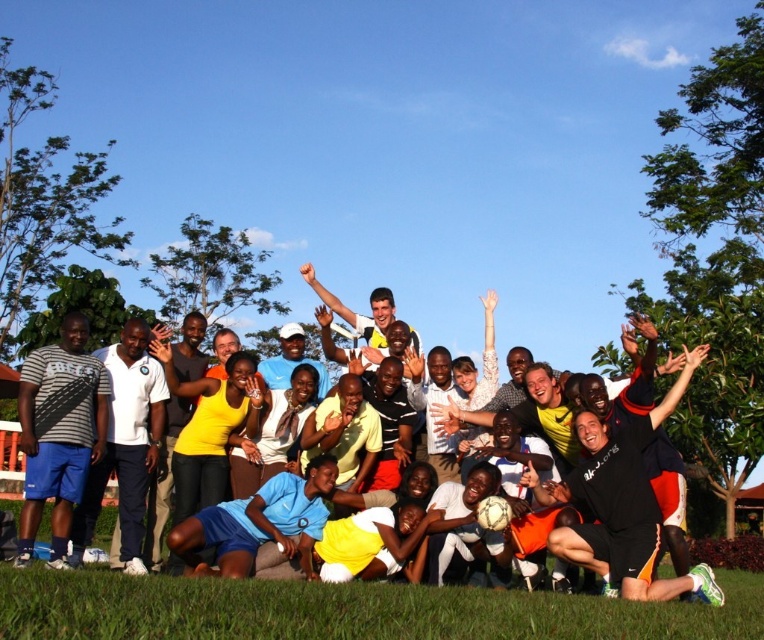
You are a photographer trying to capture a photo of the group. You notice the green grass at lower center and the matte black shirt at left. Which object is closer to the camera based on their positions?

The green grass at lower center is positioned under the matte black shirt at left, meaning the matte black shirt at left is closer to the camera since it is above the grass.

You are a photographer standing at the edge of the grassy area where the matte gray shorts at left and yellow jersey at center are located. You need to capture a photo that includes both subjects without moving them. Given that your camera has a maximum focus range of 30 feet, will you be able to capture both subjects in focus?

The distance between the matte gray shorts at left and yellow jersey at center is 31.52 feet, which exceeds the camera maximum focus range of 30 feet. Therefore, you cannot capture both subjects in focus.

You are a photographer trying to capture a photo of the group. You notice the green grass at lower center and the matte black shirt at left. Which object is taller?

The matte black shirt at left is taller than the green grass at lower center.